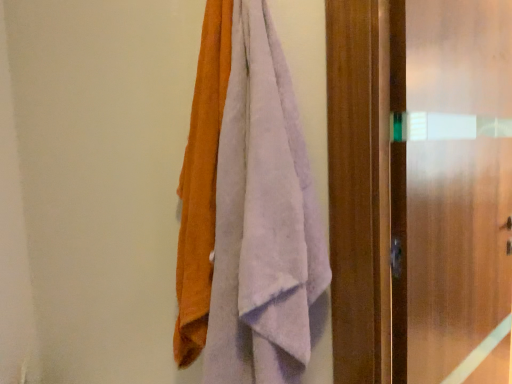
Question: Considering the positions of soft cotton towels at center and frosted glass screen door at right in the image, is soft cotton towels at center wider or thinner than frosted glass screen door at right?

Choices:
 (A) thin
 (B) wide

Answer: (B)

Question: Is soft cotton towels at center bigger or smaller than frosted glass screen door at right?

Choices:
 (A) small
 (B) big

Answer: (A)

Question: From a real-world perspective, is soft cotton towels at center above or below frosted glass screen door at right?

Choices:
 (A) above
 (B) below

Answer: (A)

Question: Relative to soft cotton towels at center, is frosted glass screen door at right in front or behind?

Choices:
 (A) front
 (B) behind

Answer: (B)

Question: From a real-world perspective, relative to soft cotton towels at center, is frosted glass screen door at right vertically above or below?

Choices:
 (A) above
 (B) below

Answer: (B)

Question: From their relative heights in the image, would you say frosted glass screen door at right is taller or shorter than soft cotton towels at center?

Choices:
 (A) short
 (B) tall

Answer: (B)

Question: Is frosted glass screen door at right bigger or smaller than soft cotton towels at center?

Choices:
 (A) big
 (B) small

Answer: (A)